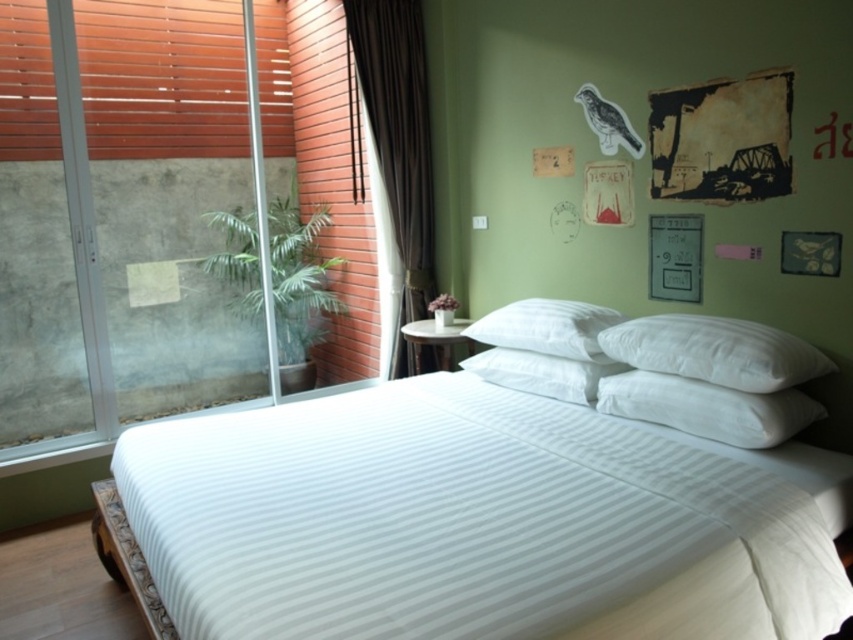
You are trying to determine if you can hang a small picture frame on the transparent glass screen door at left without it blocking the view of the white down pillow at center. Based on their heights, is this possible?

The transparent glass screen door at left is taller than the white down pillow at center, so you can hang the picture frame on the door at a position above or below the pillow to avoid blocking its view.

In the scene shown: You are trying to determine if the wooden slats at left can block the view of the dark brown fabric curtain at left when standing in the bedroom. Can you see the curtain behind the slats?

The wooden slats at left might be wider than dark brown fabric curtain at left, so it is possible that the curtain is not fully visible behind the slats.